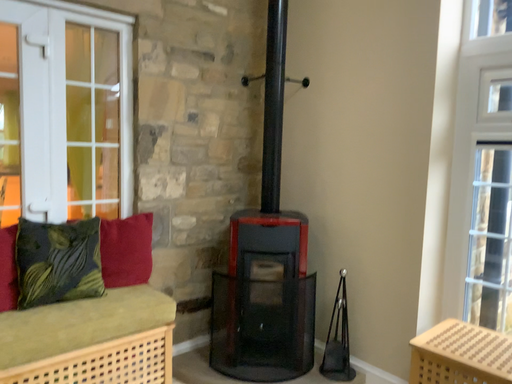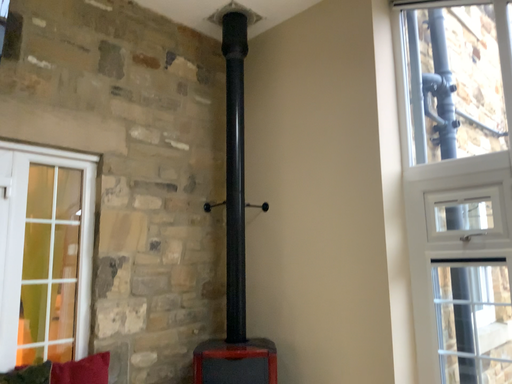
Question: Which way did the camera rotate in the video?

Choices:
 (A) rotated upward
 (B) rotated downward

Answer: (A)